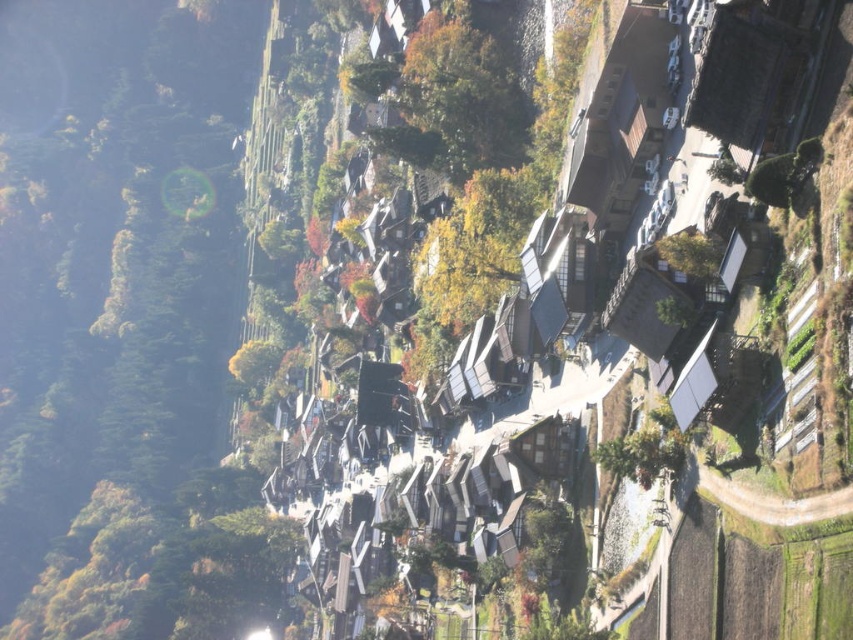
Question: Among these objects, which one is nearest to the camera?

Choices:
 (A) green matte tree at upper center
 (B) green leafy tree at upper right

Answer: (B)

Question: Is green matte tree at upper center thinner than green leafy tree at upper right?

Choices:
 (A) no
 (B) yes

Answer: (A)

Question: Can you confirm if green matte tree at upper center is positioned to the right of green leafy tree at upper right?

Choices:
 (A) yes
 (B) no

Answer: (B)

Question: Does green matte tree at upper center appear under green leafy tree at upper right?

Choices:
 (A) yes
 (B) no

Answer: (B)